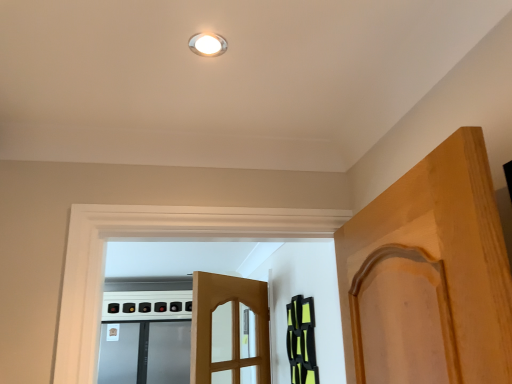
Question: Is satin silver screen door at lower left taller than white glossy light fixture at upper center?

Choices:
 (A) no
 (B) yes

Answer: (B)

Question: Does satin silver screen door at lower left come in front of white glossy light fixture at upper center?

Choices:
 (A) yes
 (B) no

Answer: (B)

Question: Is satin silver screen door at lower left at the left side of white glossy light fixture at upper center?

Choices:
 (A) no
 (B) yes

Answer: (B)

Question: Does satin silver screen door at lower left touch white glossy light fixture at upper center?

Choices:
 (A) yes
 (B) no

Answer: (B)

Question: Is white glossy light fixture at upper center located within satin silver screen door at lower left?

Choices:
 (A) no
 (B) yes

Answer: (A)

Question: Looking at their shapes, would you say satin silver screen door at lower left is wider or thinner than white glossy light fixture at upper center?

Choices:
 (A) thin
 (B) wide

Answer: (B)

Question: Considering the positions of satin silver screen door at lower left and white glossy light fixture at upper center in the image, is satin silver screen door at lower left bigger or smaller than white glossy light fixture at upper center?

Choices:
 (A) big
 (B) small

Answer: (A)

Question: Is satin silver screen door at lower left taller or shorter than white glossy light fixture at upper center?

Choices:
 (A) tall
 (B) short

Answer: (A)

Question: Does point (147, 350) appear closer or farther from the camera than point (221, 49)?

Choices:
 (A) farther
 (B) closer

Answer: (A)

Question: In the image, is black matte cabinet at right positioned in front of or behind white glossy light fixture at upper center?

Choices:
 (A) behind
 (B) front

Answer: (A)

Question: From the image's perspective, relative to white glossy light fixture at upper center, is black matte cabinet at right above or below?

Choices:
 (A) below
 (B) above

Answer: (A)

Question: In terms of height, does black matte cabinet at right look taller or shorter compared to white glossy light fixture at upper center?

Choices:
 (A) short
 (B) tall

Answer: (B)

Question: Is point (309, 321) closer or farther from the camera than point (193, 39)?

Choices:
 (A) farther
 (B) closer

Answer: (A)

Question: From their relative heights in the image, would you say black matte cabinet at right is taller or shorter than satin silver screen door at lower left?

Choices:
 (A) short
 (B) tall

Answer: (A)

Question: Is point (292, 302) closer or farther from the camera than point (146, 365)?

Choices:
 (A) farther
 (B) closer

Answer: (B)